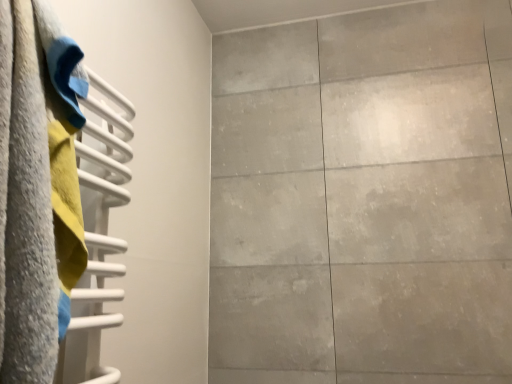
This screenshot has height=384, width=512. What are the coordinates of `textured fabric towel at left` in the screenshot? It's located at (38, 188).

In the scene shown: Measure the distance between textured fabric towel at left and camera.

textured fabric towel at left is 13.70 inches from camera.

Describe the element at coordinates (38, 188) in the screenshot. The image size is (512, 384). I see `textured fabric towel at left` at that location.

Find the location of a particular element. Image resolution: width=512 pixels, height=384 pixels. textured fabric towel at left is located at coordinates (38, 188).